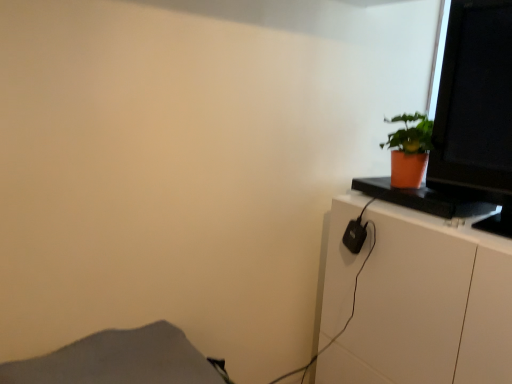
Question: From a real-world perspective, is white glossy cabinet at right located beneath gray fabric at lower left?

Choices:
 (A) no
 (B) yes

Answer: (B)

Question: Does white glossy cabinet at right lie behind gray fabric at lower left?

Choices:
 (A) no
 (B) yes

Answer: (B)

Question: Is gray fabric at lower left at the back of white glossy cabinet at right?

Choices:
 (A) yes
 (B) no

Answer: (B)

Question: Is white glossy cabinet at right bigger than gray fabric at lower left?

Choices:
 (A) yes
 (B) no

Answer: (A)

Question: Is white glossy cabinet at right thinner than gray fabric at lower left?

Choices:
 (A) no
 (B) yes

Answer: (A)

Question: Is white glossy cabinet at right to the left of gray fabric at lower left from the viewer's perspective?

Choices:
 (A) no
 (B) yes

Answer: (A)

Question: Considering the relative positions of orange matte pot at upper right and gray fabric at lower left in the image provided, is orange matte pot at upper right in front of gray fabric at lower left?

Choices:
 (A) no
 (B) yes

Answer: (A)

Question: Is gray fabric at lower left a part of orange matte pot at upper right?

Choices:
 (A) no
 (B) yes

Answer: (A)

Question: Is the surface of orange matte pot at upper right in direct contact with gray fabric at lower left?

Choices:
 (A) no
 (B) yes

Answer: (A)

Question: Is orange matte pot at upper right not within gray fabric at lower left?

Choices:
 (A) yes
 (B) no

Answer: (A)

Question: Considering the relative positions of orange matte pot at upper right and gray fabric at lower left in the image provided, is orange matte pot at upper right behind gray fabric at lower left?

Choices:
 (A) yes
 (B) no

Answer: (A)

Question: From the image's perspective, does orange matte pot at upper right appear lower than gray fabric at lower left?

Choices:
 (A) yes
 (B) no

Answer: (B)

Question: Is gray fabric at lower left taller than matte black monitor at upper right?

Choices:
 (A) no
 (B) yes

Answer: (A)